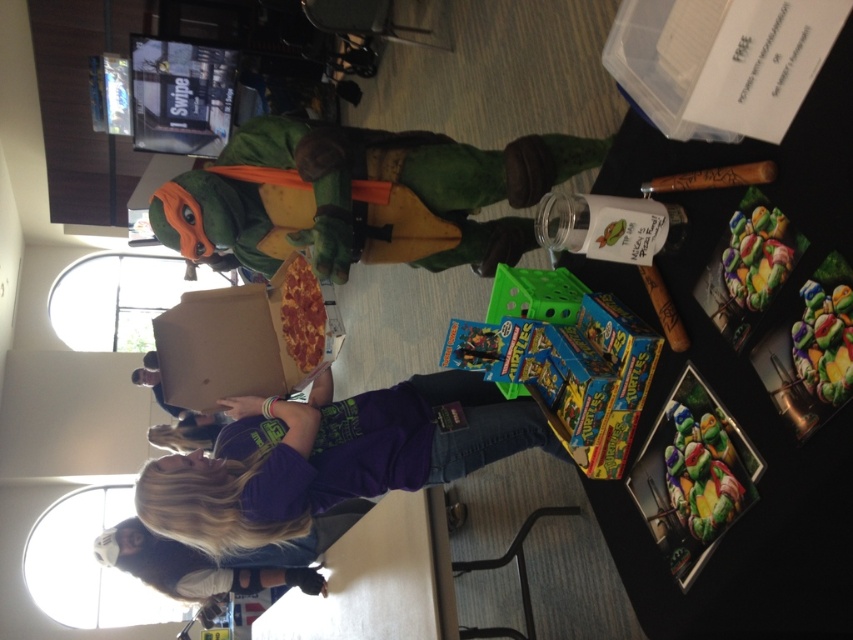
Image resolution: width=853 pixels, height=640 pixels. What do you see at coordinates (329, 458) in the screenshot?
I see `purple cotton shirt at center` at bounding box center [329, 458].

Is purple cotton shirt at center shorter than cardboard pizza box at center?

No.

Between point (376, 472) and point (279, 368), which one is positioned in front?

Positioned in front is point (376, 472).

Locate an element on the screen. This screenshot has height=640, width=853. purple cotton shirt at center is located at coordinates (329, 458).

Which is in front, point (231, 502) or point (503, 364)?

Point (503, 364) is in front.

What do you see at coordinates (329, 458) in the screenshot? I see `purple cotton shirt at center` at bounding box center [329, 458].

The image size is (853, 640). What are the coordinates of `purple cotton shirt at center` in the screenshot? It's located at (329, 458).

Locate an element on the screen. This screenshot has height=640, width=853. purple cotton shirt at center is located at coordinates (329, 458).

Can you confirm if blue cardboard toy at center is smaller than cardboard pizza box at center?

No, blue cardboard toy at center is not smaller than cardboard pizza box at center.

Is blue cardboard toy at center above cardboard pizza box at center?

No, blue cardboard toy at center is not above cardboard pizza box at center.

Is point (611, 324) in front of point (196, 321)?

Yes, it is.

The height and width of the screenshot is (640, 853). In order to click on blue cardboard toy at center in this screenshot , I will do `click(566, 362)`.